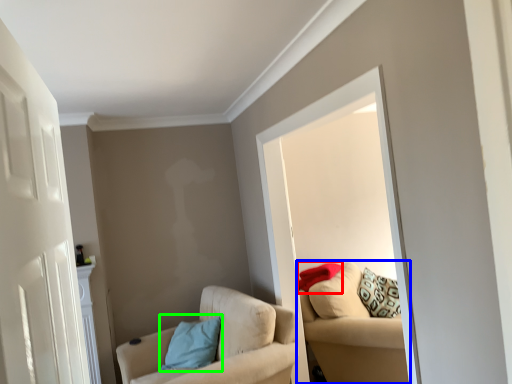
Question: Which object is positioned farthest from pillow (highlighted by a red box)? Select from studio couch (highlighted by a blue box) and pillow (highlighted by a green box).

Choices:
 (A) studio couch
 (B) pillow

Answer: (B)